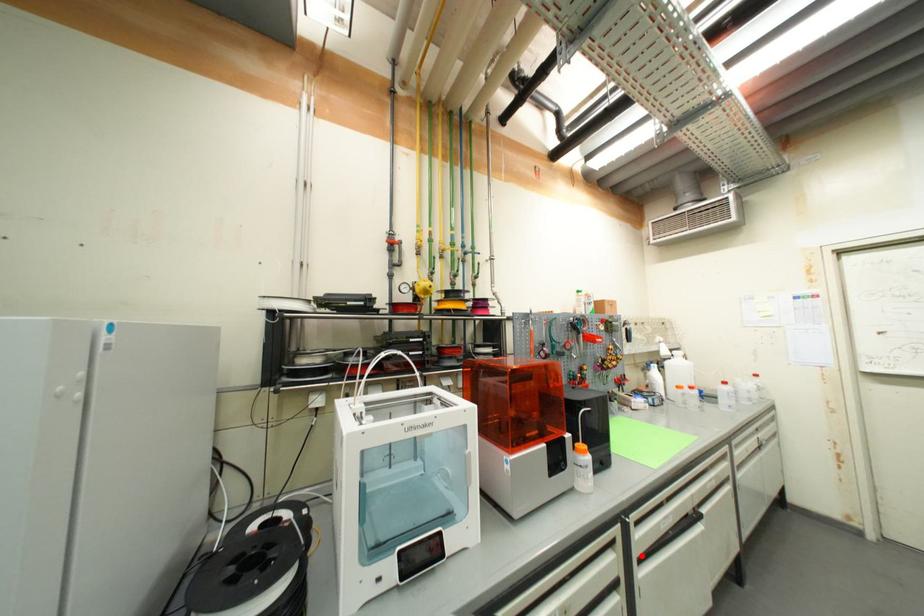
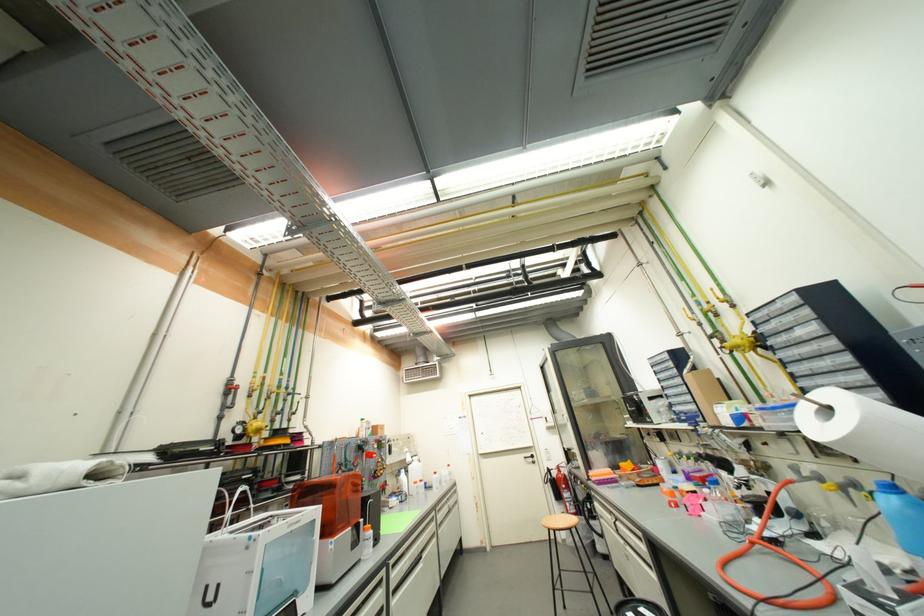
The point at the highlighted location is marked in the first image. Where is the corresponding point in the second image?

(396, 590)